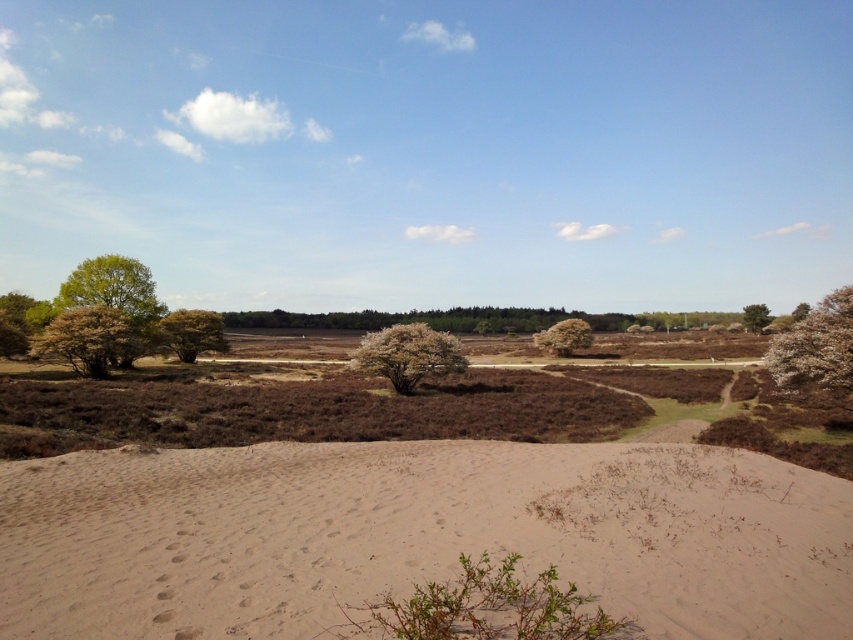
You are standing at the point marked as point (112, 289) in the image. What can you see in the direction of the upper left from your current position?

In the direction of upper left from point (112, 289), there is a green leafy tree at upper left.

You are planning to plant a new flowerbed in the sandy area. The flowerbed needs to be placed where there is enough space between the green leafy bush at left and the green leafy tree at upper right. Can you determine if there is sufficient space between them?

The green leafy bush at left occupies less space than the green leafy tree at upper right, but the description does not provide specific measurements of the distance between them. Therefore, it is unclear if there is enough space for the flowerbed between them.

You are planning to plant a new flowerbed in the sandy area. You want to ensure that the flowers will receive enough sunlight. Considering the green leafy bush at left and the green leafy tree at upper right, which one might cast a shorter shadow at noon, allowing more sunlight to reach the flowers?

The green leafy bush at left has a lesser height compared to the green leafy tree at upper right, so it will cast a shorter shadow at noon. Therefore, planting the flowers near the green leafy bush at left would allow them to receive more sunlight.